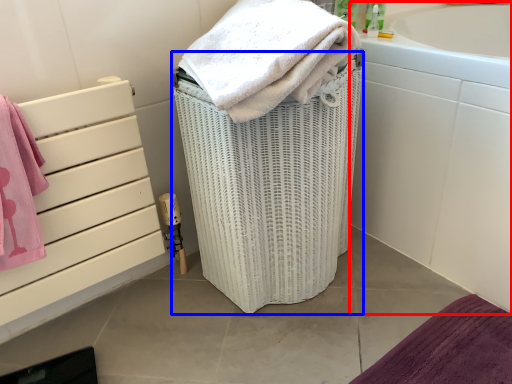
Question: Which point is closer to the camera, bath (highlighted by a red box) or basket container (highlighted by a blue box)?

Choices:
 (A) bath
 (B) basket container

Answer: (B)